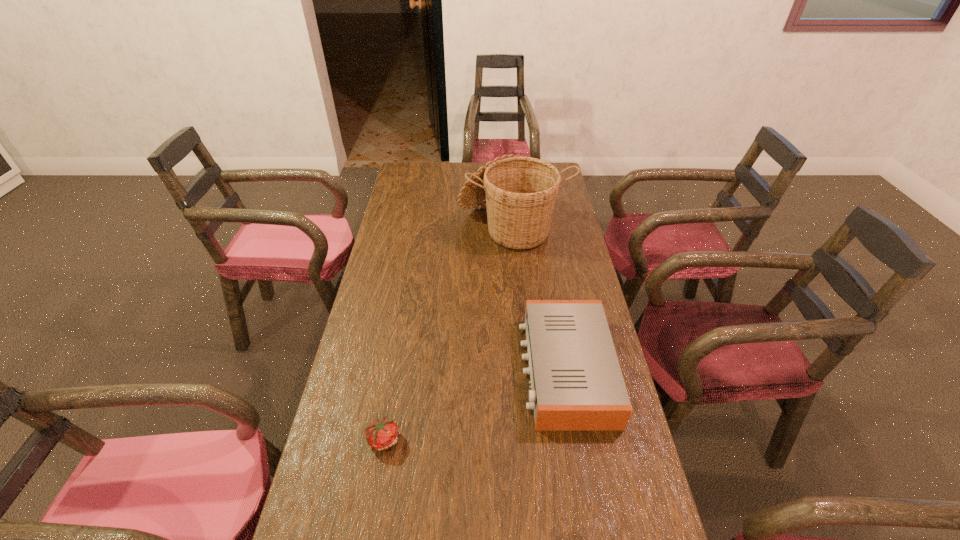
Find the location of a particular element. Image resolution: width=960 pixels, height=540 pixels. object that is at the left edge is located at coordinates (381, 434).

Locate an element on the screen. basket located in the right edge section of the desktop is located at coordinates (520, 193).

The width and height of the screenshot is (960, 540). What are the coordinates of `radio receiver situated at the right edge` in the screenshot? It's located at (576, 381).

You are a GUI agent. You are given a task and a screenshot of the screen. Output one action in this format:
    pyautogui.click(x=<x>, y=<y>)
    Task: Click on the vacant space at the far edge of the desktop
    The height and width of the screenshot is (540, 960).
    Given the screenshot: What is the action you would take?
    pyautogui.click(x=467, y=170)

In the image, there is a desktop. Where is `vacant space at the left edge`? Image resolution: width=960 pixels, height=540 pixels. vacant space at the left edge is located at coordinates 372,284.

The width and height of the screenshot is (960, 540). Identify the location of free space at the right edge of the desktop. (592, 292).

Locate an element on the screen. vacant space that's between the shortest object and the radio receiver is located at coordinates (474, 404).

In order to click on vacant area that lies between the shortest object and the second shortest object in this screenshot , I will do `click(474, 404)`.

Image resolution: width=960 pixels, height=540 pixels. I want to click on vacant space in between the tallest object and the tomato, so click(448, 332).

You are a GUI agent. You are given a task and a screenshot of the screen. Output one action in this format:
    pyautogui.click(x=<x>, y=<y>)
    Task: Click on the free space that is in between the tomato and the basket
    The image size is (960, 540).
    Given the screenshot: What is the action you would take?
    pyautogui.click(x=448, y=332)